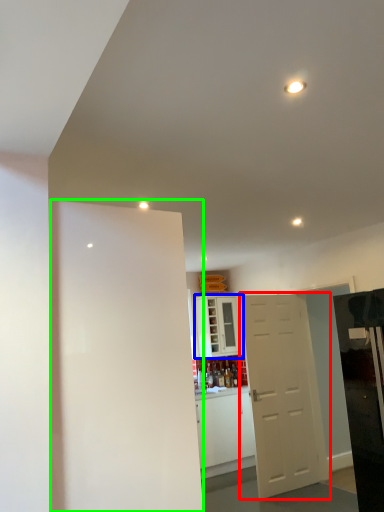
Question: Which object is the farthest from door (highlighted by a red box)? Choose among these: cabinetry (highlighted by a blue box) or door (highlighted by a green box).

Choices:
 (A) cabinetry
 (B) door

Answer: (B)